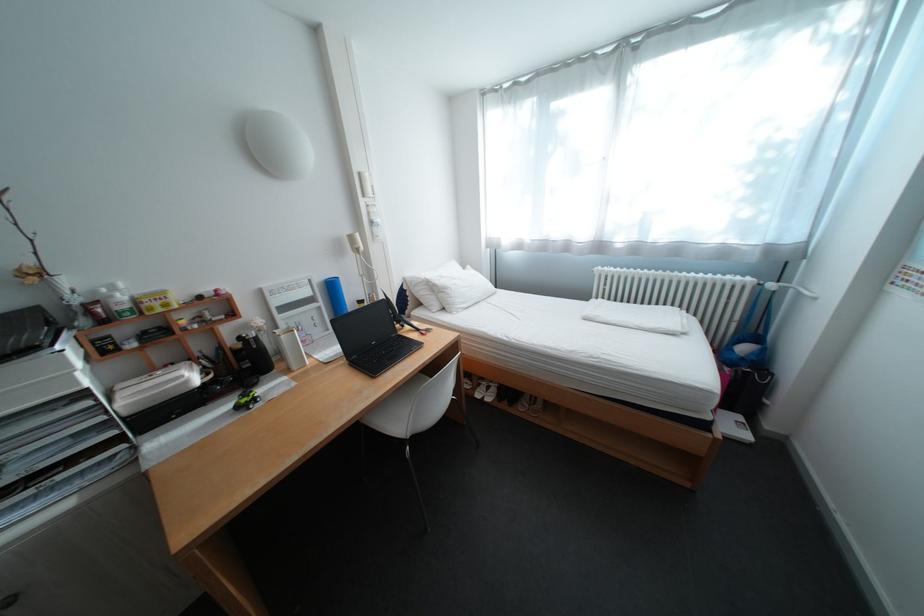
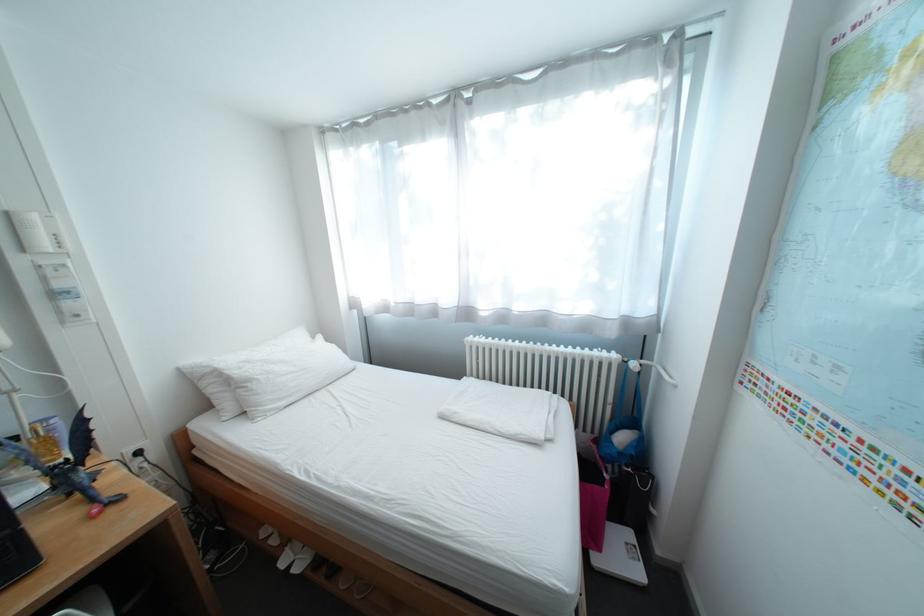
Find the pixel in the second image that matches [763,354] in the first image.

(642, 447)